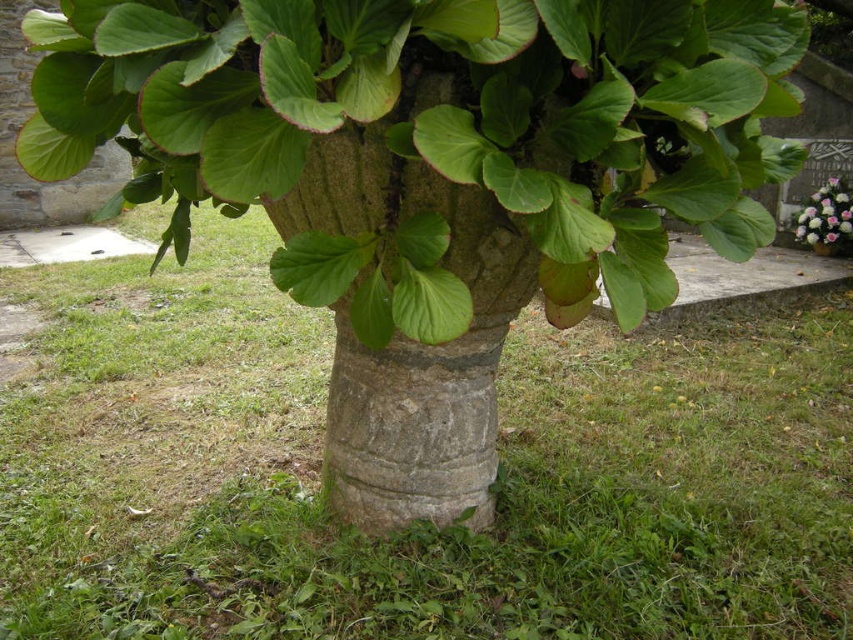
Who is lower down, smooth stone tree trunk at center or pink floral bouquet at upper right?

smooth stone tree trunk at center

Is smooth stone tree trunk at center smaller than pink floral bouquet at upper right?

No.

What do you see at coordinates (407, 339) in the screenshot?
I see `smooth stone tree trunk at center` at bounding box center [407, 339].

This screenshot has width=853, height=640. I want to click on smooth stone tree trunk at center, so click(x=407, y=339).